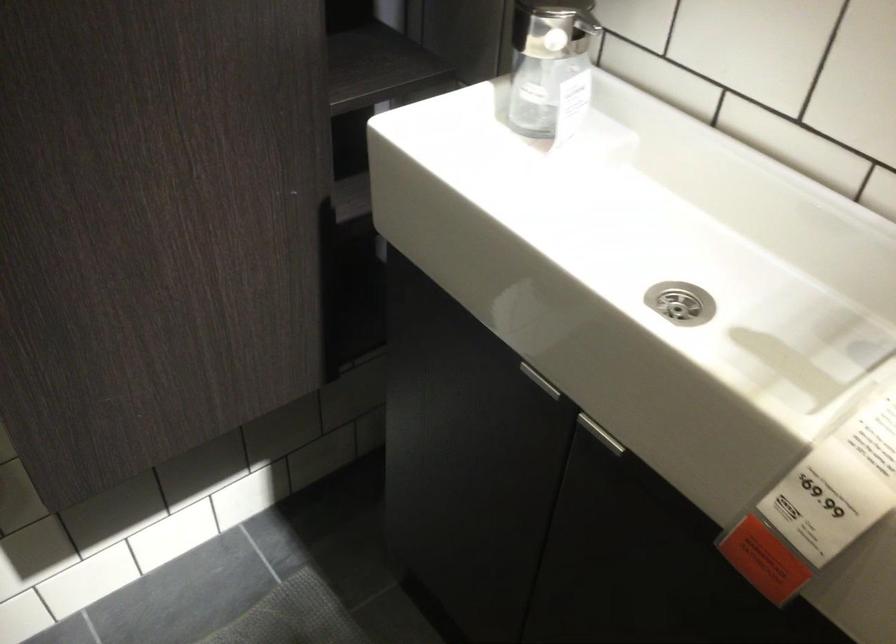
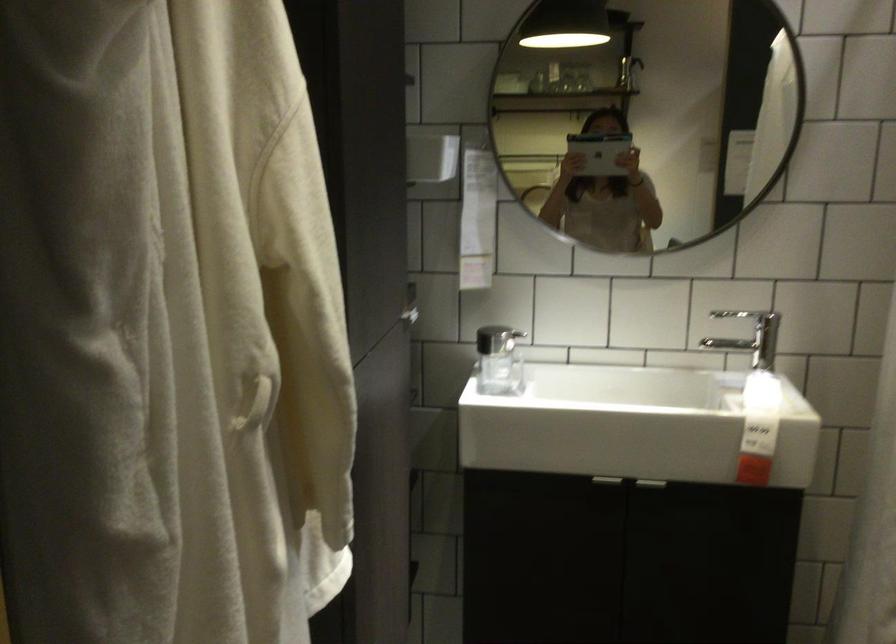
Locate, in the second image, the point that corresponds to (x=590, y=420) in the first image.

(650, 484)